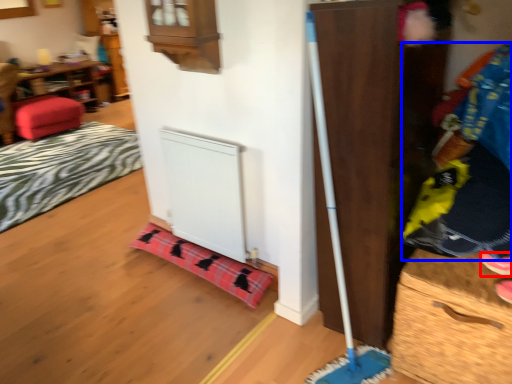
Question: Which of the following is the closest to the observer, shoe (highlighted by a red box) or clothing (highlighted by a blue box)?

Choices:
 (A) shoe
 (B) clothing

Answer: (B)